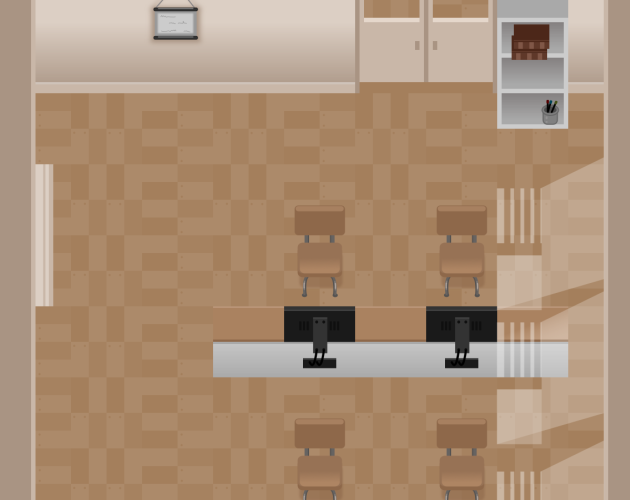
This screenshot has width=630, height=500. Find the location of `white desk`. white desk is located at coordinates coord(421,358).